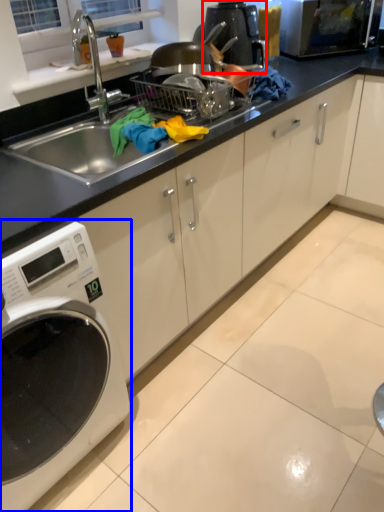
Question: Which of the following is the closest to the observer, coffee machine (highlighted by a red box) or home appliance (highlighted by a blue box)?

Choices:
 (A) coffee machine
 (B) home appliance

Answer: (B)